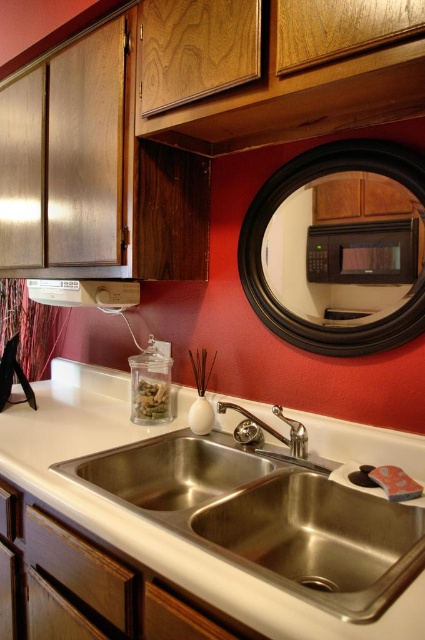
Consider the image. You are standing in the kitchen and see two points marked in the scene. Which point is closer to you, point (275, 324) or point (334, 244)?

Point (275, 324) is closer to you because it is further to the viewer than point (334, 244).

You are standing in front of the kitchen sink and want to place a small object on the countertop. There are two points marked on the countertop at coordinates point (419, 173) and point (299, 458). Which point is closer to you?

Point (419, 173) is closer to the camera than point (299, 458), so you should place the object there if you want it closer to your current position.

You are standing in the kitchen and want to hang a new painting exactly where the black framed mirror at upper center is currently located. What are the coordinates where you should place the new painting?

The coordinates for the black framed mirror at upper center are at point (277, 208), so you should place the new painting there.